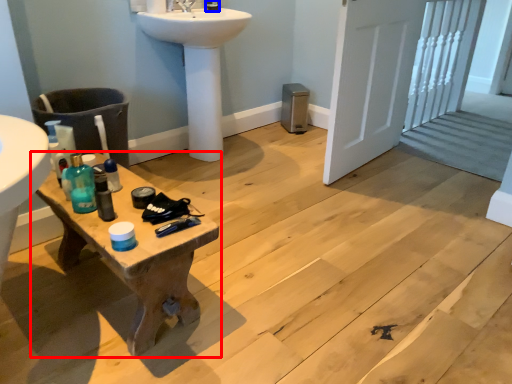
Question: Which of the following is the closest to the observer, table (highlighted by a red box) or toiletry (highlighted by a blue box)?

Choices:
 (A) table
 (B) toiletry

Answer: (A)